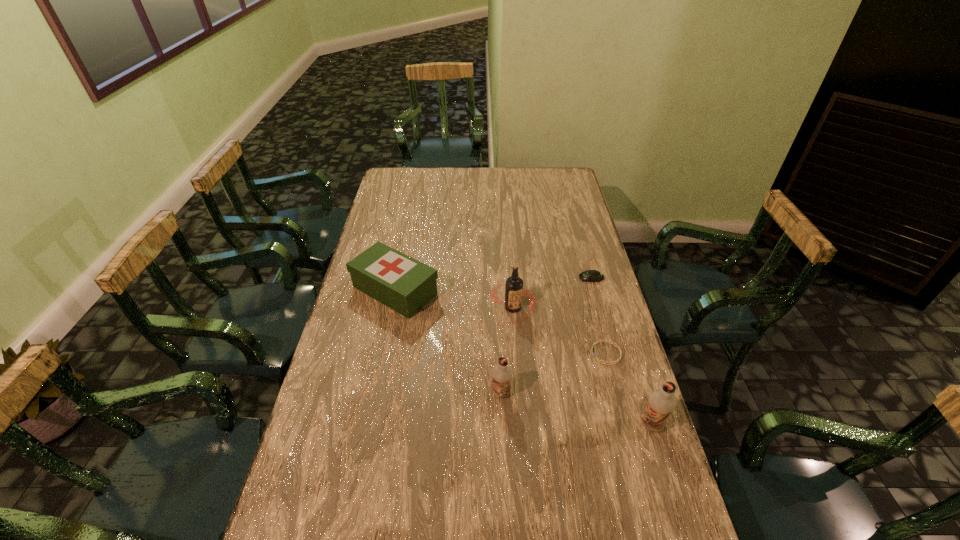
The width and height of the screenshot is (960, 540). Find the location of `object at the left edge`. object at the left edge is located at coordinates (402, 283).

At what (x,y) coordinates should I click in order to perform the action: click on chocolate milk present at the right edge. Please return your answer as a coordinate pair (x, y). The width and height of the screenshot is (960, 540). Looking at the image, I should click on (661, 402).

Where is `computer mouse that is positioned at the right edge`? computer mouse that is positioned at the right edge is located at coordinates (590, 275).

At what (x,y) coordinates should I click in order to perform the action: click on bracelet at the right edge. Please return your answer as a coordinate pair (x, y). The height and width of the screenshot is (540, 960). Looking at the image, I should click on (596, 342).

In the image, there is a desktop. Where is `vacant space at the far edge`? vacant space at the far edge is located at coordinates (485, 188).

Identify the location of vacant space at the left edge of the desktop. (372, 220).

This screenshot has height=540, width=960. In order to click on vacant region at the right edge of the desktop in this screenshot , I will do `click(624, 388)`.

You are a GUI agent. You are given a task and a screenshot of the screen. Output one action in this format:
    pyautogui.click(x=<x>, y=<y>)
    Task: Click on the free space at the near left corner
    The width and height of the screenshot is (960, 540).
    Given the screenshot: What is the action you would take?
    tap(348, 515)

This screenshot has width=960, height=540. I want to click on vacant area at the far right corner, so click(x=540, y=175).

You are a GUI agent. You are given a task and a screenshot of the screen. Output one action in this format:
    pyautogui.click(x=<x>, y=<y>)
    Task: Click on the free area in between the nearer chocolate milk and the root beer
    The height and width of the screenshot is (540, 960).
    Given the screenshot: What is the action you would take?
    pyautogui.click(x=583, y=366)